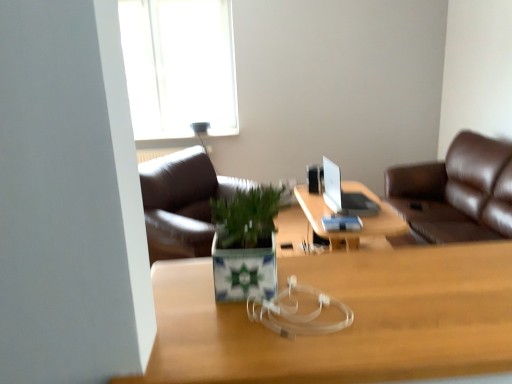
Question: Is wooden table at center smaller than green ceramic pot at center?

Choices:
 (A) yes
 (B) no

Answer: (B)

Question: Can you confirm if wooden table at center is taller than green ceramic pot at center?

Choices:
 (A) no
 (B) yes

Answer: (B)

Question: Considering the relative positions of wooden table at center and green ceramic pot at center in the image provided, is wooden table at center to the left of green ceramic pot at center from the viewer's perspective?

Choices:
 (A) no
 (B) yes

Answer: (A)

Question: Is wooden table at center beside green ceramic pot at center?

Choices:
 (A) yes
 (B) no

Answer: (B)

Question: Would you say wooden table at center contains green ceramic pot at center?

Choices:
 (A) yes
 (B) no

Answer: (B)

Question: From the image's perspective, is silver metallic laptop at center positioned above or below wooden table at center?

Choices:
 (A) below
 (B) above

Answer: (B)

Question: Is point (324, 198) closer or farther from the camera than point (297, 193)?

Choices:
 (A) farther
 (B) closer

Answer: (B)

Question: From their relative heights in the image, would you say silver metallic laptop at center is taller or shorter than wooden table at center?

Choices:
 (A) tall
 (B) short

Answer: (B)

Question: From a real-world perspective, relative to wooden table at center, is silver metallic laptop at center vertically above or below?

Choices:
 (A) above
 (B) below

Answer: (A)

Question: From their relative heights in the image, would you say wooden table at center is taller or shorter than green ceramic pot at center?

Choices:
 (A) short
 (B) tall

Answer: (B)

Question: Choose the correct answer: Is wooden table at center inside green ceramic pot at center or outside it?

Choices:
 (A) outside
 (B) inside

Answer: (A)

Question: From the image's perspective, is wooden table at center positioned above or below green ceramic pot at center?

Choices:
 (A) above
 (B) below

Answer: (B)

Question: In the image, is wooden table at center on the left side or the right side of green ceramic pot at center?

Choices:
 (A) left
 (B) right

Answer: (B)

Question: From a real-world perspective, is wooden table at center positioned above or below wooden desk at center?

Choices:
 (A) below
 (B) above

Answer: (A)

Question: Is wooden table at center inside the boundaries of wooden desk at center, or outside?

Choices:
 (A) inside
 (B) outside

Answer: (B)